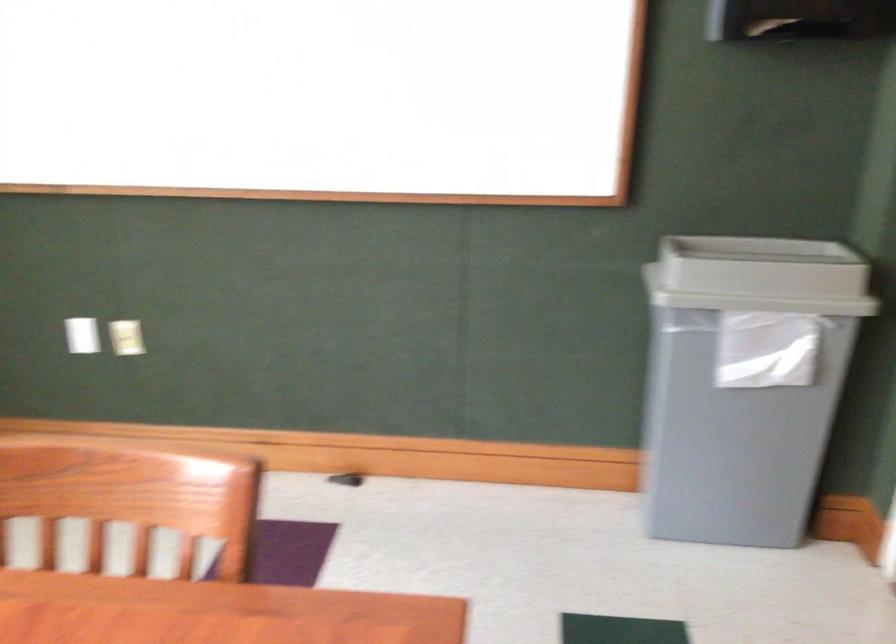
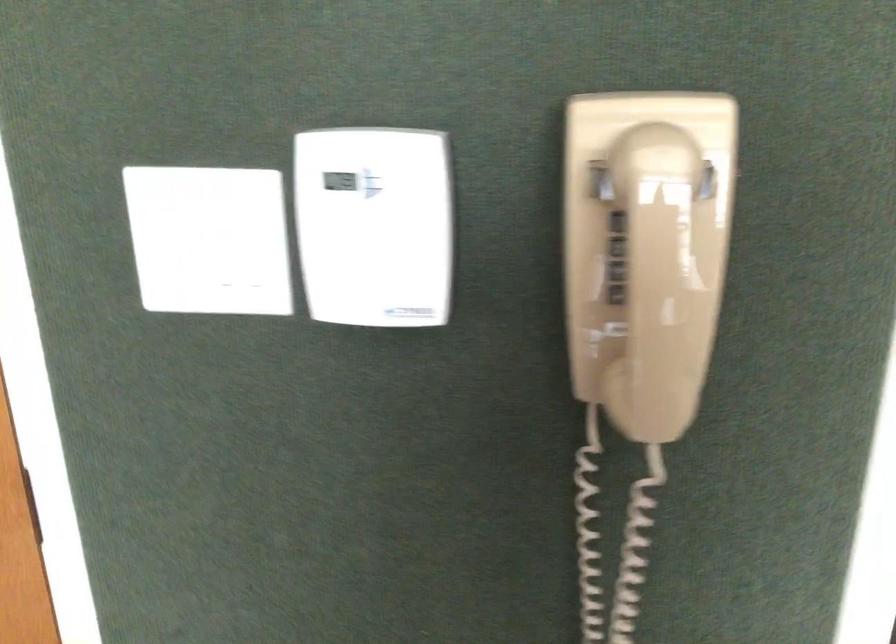
First-person continuous shooting, in which direction is the camera rotating?

The camera rotated toward right-down.